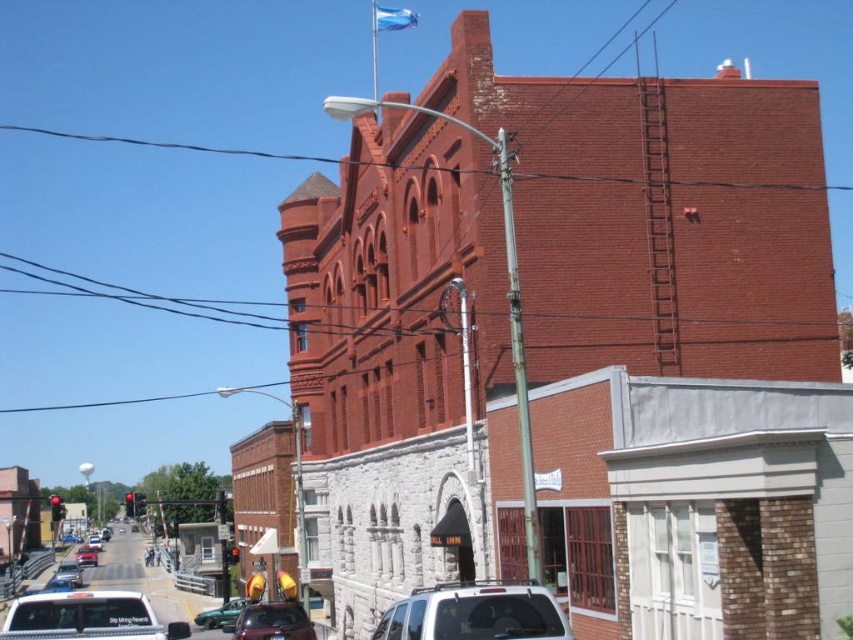
You are standing in the urban street scene and want to determine which of the two points, point (311, 628) or point (395, 26), is nearer to you. Based on the scene description, which point is closer?

Point (311, 628) is closer to the viewer than point (395, 26).

Looking at this image, you are standing in the urban street scene looking at the red brick building and the white stone structure with the sign HILL INN. There are two points marked in the image. The first point is at coordinates point (389, 12) and the second point is at point (94, 538). Which of these two points is closer to your viewpoint?

Point (389, 12) is closer to the camera than point (94, 538).